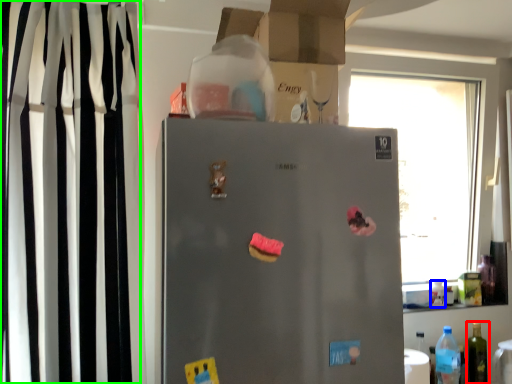
Question: Estimate the real-world distances between objects in this image. Which object is closer to bottle (highlighted by a red box), bottle (highlighted by a blue box) or curtain (highlighted by a green box)?

Choices:
 (A) bottle
 (B) curtain

Answer: (A)